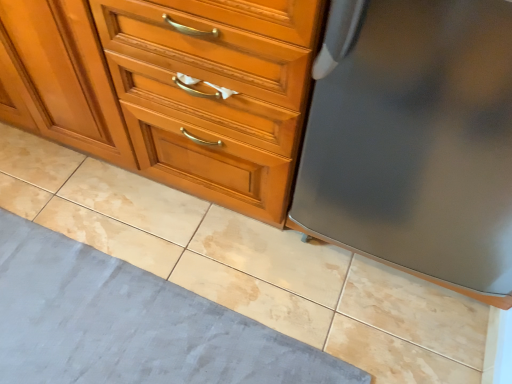
At what (x,y) coordinates should I click in order to perform the action: click on free point above gray fabric bath mat at lower left (from a real-world perspective). Please return your answer as a coordinate pair (x, y). The height and width of the screenshot is (384, 512). Looking at the image, I should click on (105, 324).